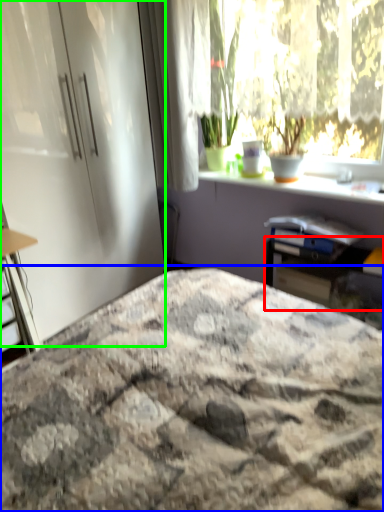
Question: Which is farther away from table (highlighted by a red box)? bed (highlighted by a blue box) or screen door (highlighted by a green box)?

Choices:
 (A) bed
 (B) screen door

Answer: (B)